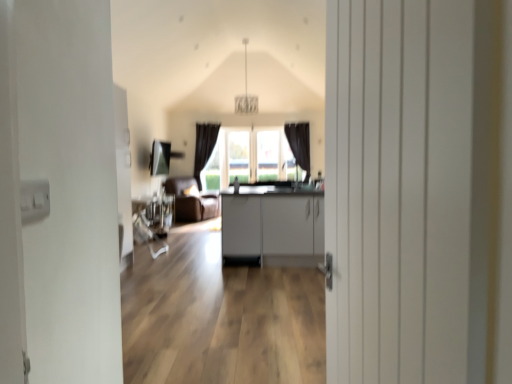
Question: From a real-world perspective, relative to matte gray cabinets at center, is brown leather armchair at center vertically above or below?

Choices:
 (A) above
 (B) below

Answer: (A)

Question: Considering the positions of point (218, 205) and point (262, 201), is point (218, 205) closer or farther from the camera than point (262, 201)?

Choices:
 (A) closer
 (B) farther

Answer: (B)

Question: Which is nearer to the white wooden door at center?

Choices:
 (A) matte gray cabinets at center
 (B) brown leather armchair at center

Answer: (A)

Question: Which object is the farthest from the matte gray cabinets at center?

Choices:
 (A) brown leather armchair at center
 (B) white wooden door at center

Answer: (B)